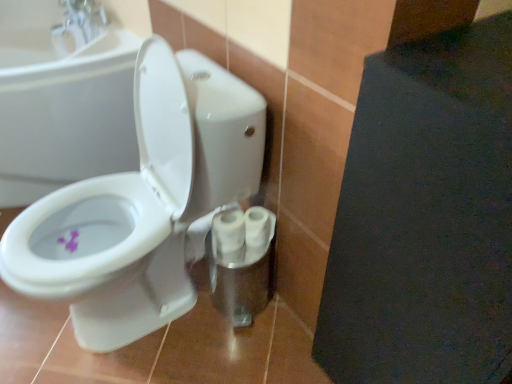
Question: Does purple matte flower at lower left have a larger size compared to white glossy sink at upper left?

Choices:
 (A) no
 (B) yes

Answer: (A)

Question: From the image's perspective, does purple matte flower at lower left appear higher than white glossy sink at upper left?

Choices:
 (A) yes
 (B) no

Answer: (B)

Question: Is the surface of purple matte flower at lower left in direct contact with white glossy sink at upper left?

Choices:
 (A) no
 (B) yes

Answer: (A)

Question: From the image's perspective, is purple matte flower at lower left below white glossy sink at upper left?

Choices:
 (A) yes
 (B) no

Answer: (A)

Question: Can you confirm if purple matte flower at lower left is smaller than white glossy sink at upper left?

Choices:
 (A) yes
 (B) no

Answer: (A)

Question: Is purple matte flower at lower left far from white glossy sink at upper left?

Choices:
 (A) yes
 (B) no

Answer: (B)

Question: Does white glossy toilet at center come behind white glossy sink at upper left?

Choices:
 (A) no
 (B) yes

Answer: (A)

Question: Is white glossy toilet at center looking in the opposite direction of white glossy sink at upper left?

Choices:
 (A) yes
 (B) no

Answer: (B)

Question: From the image's perspective, is white glossy toilet at center located above white glossy sink at upper left?

Choices:
 (A) no
 (B) yes

Answer: (A)

Question: Is white glossy toilet at center smaller than white glossy sink at upper left?

Choices:
 (A) yes
 (B) no

Answer: (B)

Question: Can you confirm if white glossy toilet at center is shorter than white glossy sink at upper left?

Choices:
 (A) no
 (B) yes

Answer: (A)

Question: Can you confirm if white glossy toilet at center is positioned to the right of white glossy sink at upper left?

Choices:
 (A) yes
 (B) no

Answer: (A)

Question: Can you confirm if white glossy toilet paper at center, which is the 1th toilet paper in left-to-right order, is thinner than white glossy toilet at center left?

Choices:
 (A) yes
 (B) no

Answer: (A)